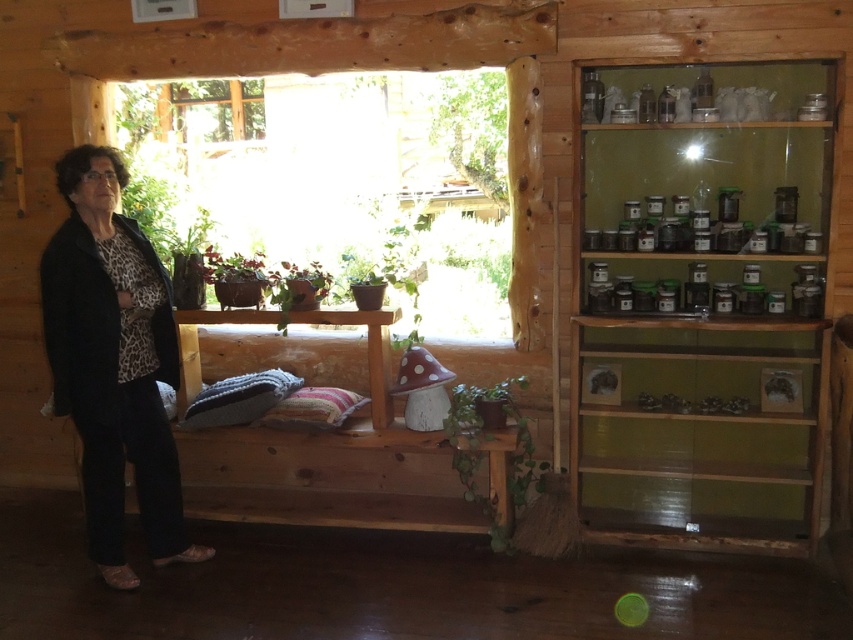
You are a guest in this cabin and want to place a small potted plant on the clear glass shelves at upper right. However, there is already a matte brown pot at center on top of it. Can you still place your plant there?

The clear glass shelves at upper right is below the matte brown pot at center, meaning the shelves are underneath the pot. Since the shelves are under the pot, you cannot place your plant on the shelves because the pot is blocking access to them.

You are a delivery person carrying a package that is 30 inches long. You need to place it between the transparent glass window at center and the matte brown pot at center. Is there enough space for the package?

The distance between the transparent glass window at center and the matte brown pot at center is 27.83 inches. Since the package is 30 inches long, it is 2.17 inches too long to fit in the available space.